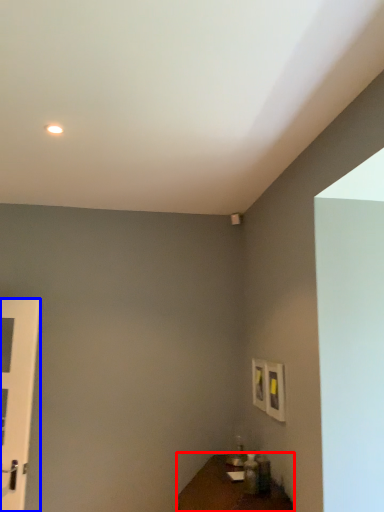
Question: Which of the following is the closest to the observer, table (highlighted by a red box) or door (highlighted by a blue box)?

Choices:
 (A) table
 (B) door

Answer: (A)